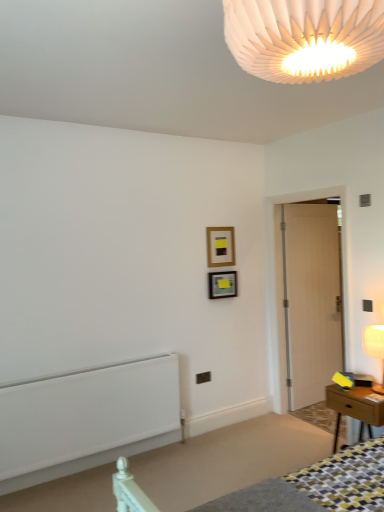
Question: Is white pleated paper lampshade at upper center, which appears as the 2th lamp when ordered from the bottom, surrounding wooden table at right?

Choices:
 (A) no
 (B) yes

Answer: (A)

Question: Is white pleated paper lampshade at upper center, marked as the 1th lamp in a top-to-bottom arrangement, further to the viewer compared to wooden table at right?

Choices:
 (A) no
 (B) yes

Answer: (A)

Question: Is white pleated paper lampshade at upper center, which is the second lamp from back to front, in front of wooden table at right?

Choices:
 (A) yes
 (B) no

Answer: (A)

Question: Can you confirm if white pleated paper lampshade at upper center, the first lamp in the left-to-right sequence, is shorter than wooden table at right?

Choices:
 (A) no
 (B) yes

Answer: (B)

Question: Considering the relative sizes of white pleated paper lampshade at upper center, which appears as the 2th lamp when ordered from the bottom, and wooden table at right in the image provided, is white pleated paper lampshade at upper center, which appears as the 2th lamp when ordered from the bottom, smaller than wooden table at right?

Choices:
 (A) yes
 (B) no

Answer: (A)

Question: Can we say white pleated paper lampshade at upper center, the first lamp in the left-to-right sequence, lies outside wooden table at right?

Choices:
 (A) yes
 (B) no

Answer: (A)

Question: Is wooden table at right positioned before white matte radiator at lower left?

Choices:
 (A) yes
 (B) no

Answer: (A)

Question: Is wooden table at right not inside white matte radiator at lower left?

Choices:
 (A) yes
 (B) no

Answer: (A)

Question: Does wooden table at right turn towards white matte radiator at lower left?

Choices:
 (A) yes
 (B) no

Answer: (B)

Question: From a real-world perspective, is wooden table at right positioned over white matte radiator at lower left based on gravity?

Choices:
 (A) yes
 (B) no

Answer: (B)

Question: From a real-world perspective, does wooden table at right sit lower than white matte radiator at lower left?

Choices:
 (A) yes
 (B) no

Answer: (A)

Question: Is wooden table at right far away from white matte radiator at lower left?

Choices:
 (A) no
 (B) yes

Answer: (B)

Question: Does wooden picture frame at upper center, acting as the 1th picture frame starting from the top, appear on the right side of wooden table at right?

Choices:
 (A) yes
 (B) no

Answer: (B)